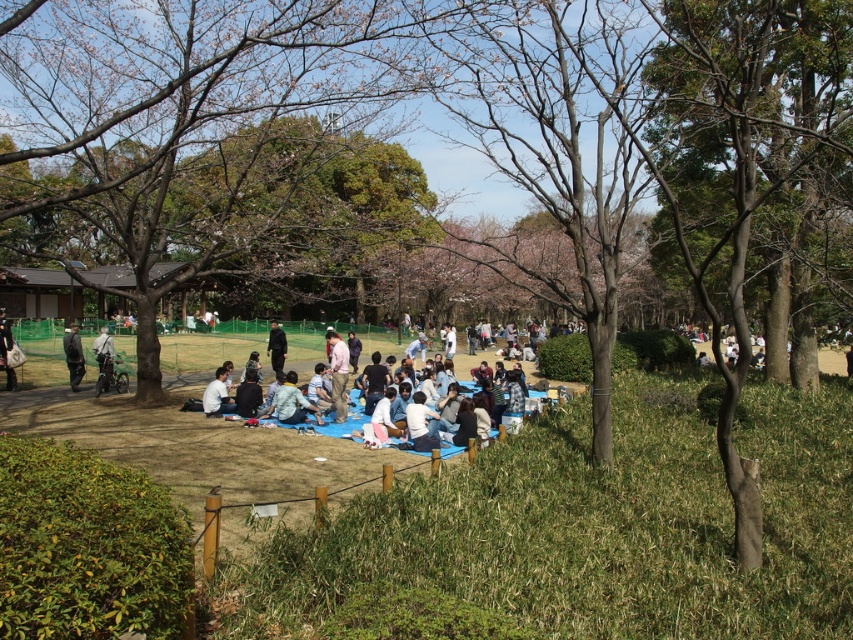
You are standing in the park and see the light brown fabric shirt at center and the light gray fabric bag at center. Which object is nearer to you?

The light brown fabric shirt at center is closer to the viewer than the light gray fabric bag at center.

You are standing at the point with coordinates point [103,333] and want to walk towards the picnic blanket. There is an obstacle at point [332,380]. Will you encounter this obstacle before reaching the picnic blanket?

Point [332,380] is in front of point [103,333], so yes, you will encounter the obstacle at point [332,380] before reaching the picnic blanket.